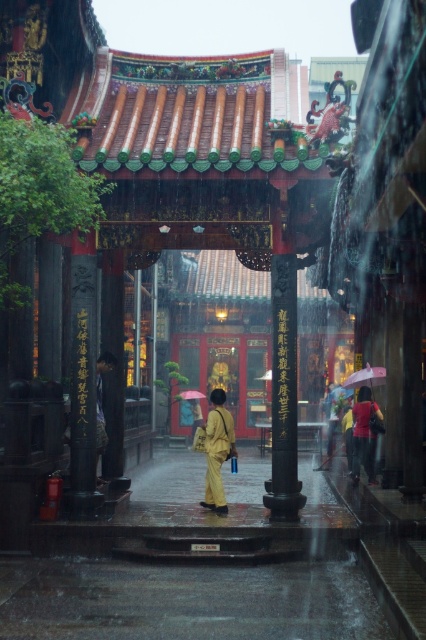
Does yellow fabric umbrella at center have a greater width compared to yellow matte dress at center?

In fact, yellow fabric umbrella at center might be narrower than yellow matte dress at center.

Is yellow fabric umbrella at center smaller than yellow matte dress at center?

Yes, yellow fabric umbrella at center is smaller than yellow matte dress at center.

Measure the distance between point (x=218, y=392) and camera.

They are 16.21 meters apart.

Find the location of `yellow fabric umbrella at center`. yellow fabric umbrella at center is located at coordinates (218, 451).

Can you confirm if pink matte umbrella at center is bigger than red matte umbrella at center?

Correct, pink matte umbrella at center is larger in size than red matte umbrella at center.

You are a GUI agent. You are given a task and a screenshot of the screen. Output one action in this format:
    pyautogui.click(x=<x>, y=<y>)
    Task: Click on the pink matte umbrella at center
    The image size is (426, 640).
    Given the screenshot: What is the action you would take?
    pyautogui.click(x=365, y=378)

Does yellow matte dress at center appear on the right side of red matte umbrella at center?

Correct, you'll find yellow matte dress at center to the right of red matte umbrella at center.

Does point (362, 408) come in front of point (181, 397)?

Yes.

The image size is (426, 640). Find the location of `yellow matte dress at center`. yellow matte dress at center is located at coordinates (365, 433).